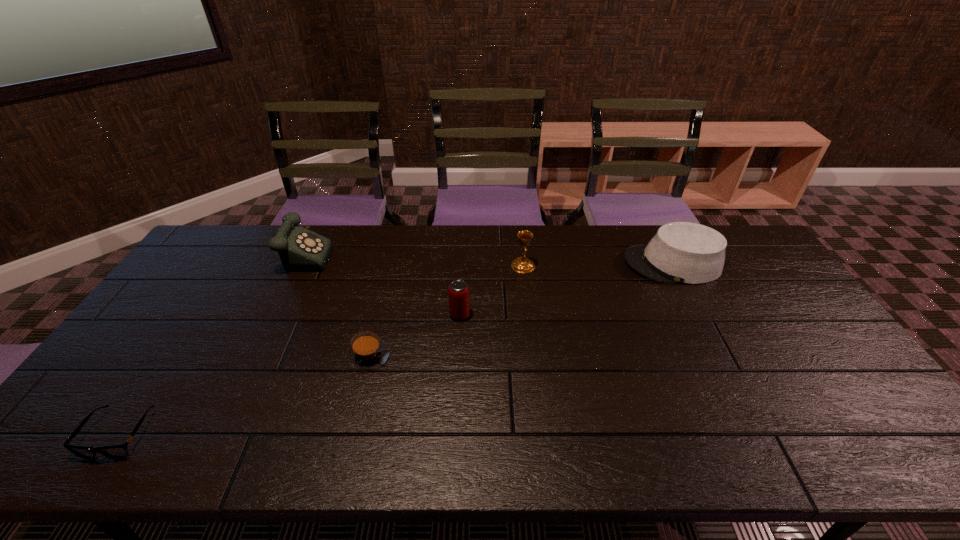
Locate an element on the screen. This screenshot has width=960, height=540. vacant space that is in between the second shortest object and the leftmost object is located at coordinates (244, 395).

Locate an element on the screen. This screenshot has width=960, height=540. free space between the second object from left to right and the third object from left to right is located at coordinates (337, 303).

You are a GUI agent. You are given a task and a screenshot of the screen. Output one action in this format:
    pyautogui.click(x=<x>, y=<y>)
    Task: Click on the vacant space that is in between the beer can and the fifth object from left to right
    
    Given the screenshot: What is the action you would take?
    pyautogui.click(x=492, y=290)

Where is `vacant space that is in between the rightmost object and the fifth object from right to left`? vacant space that is in between the rightmost object and the fifth object from right to left is located at coordinates (489, 257).

Find the location of `vacant area that lies between the fifth farthest object and the fifth object from left to right`. vacant area that lies between the fifth farthest object and the fifth object from left to right is located at coordinates (445, 311).

The image size is (960, 540). I want to click on vacant region between the sunglasses and the rightmost object, so click(396, 349).

This screenshot has width=960, height=540. What are the coordinates of `unoccupied area between the third object from left to right and the beer can` in the screenshot? It's located at (414, 335).

You are a GUI agent. You are given a task and a screenshot of the screen. Output one action in this format:
    pyautogui.click(x=<x>, y=<y>)
    Task: Click on the empty space that is in between the rightmost object and the sunglasses
    The image size is (960, 540).
    Given the screenshot: What is the action you would take?
    pyautogui.click(x=396, y=349)

You are a GUI agent. You are given a task and a screenshot of the screen. Output one action in this format:
    pyautogui.click(x=<x>, y=<y>)
    Task: Click on the free space that is in between the second object from left to right and the fourth object from left to right
    
    Given the screenshot: What is the action you would take?
    [382, 283]

You are a GUI agent. You are given a task and a screenshot of the screen. Output one action in this format:
    pyautogui.click(x=<x>, y=<y>)
    Task: Click on the object that is the fifth closest to the fifth object from right to left
    This screenshot has height=540, width=960.
    Given the screenshot: What is the action you would take?
    pyautogui.click(x=680, y=252)